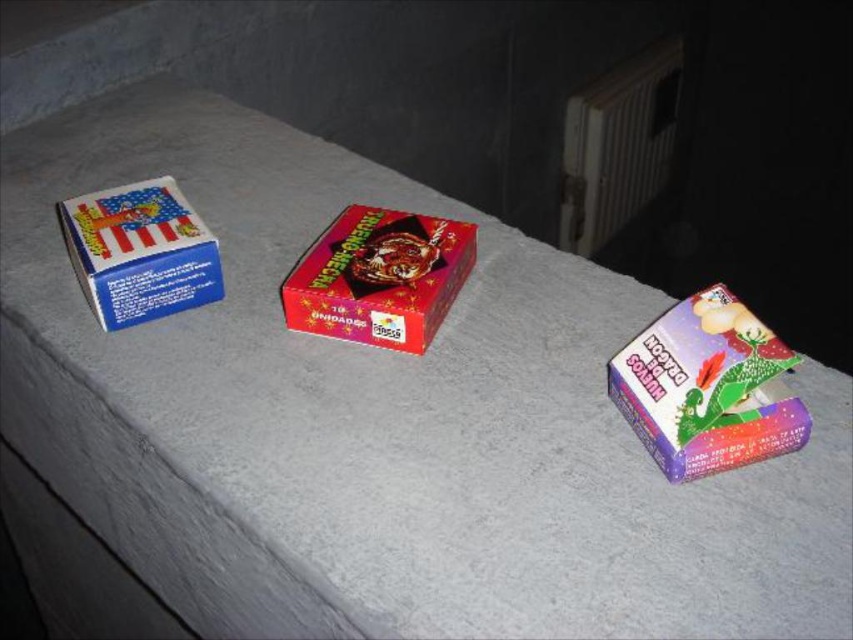
Question: Estimate the real-world distances between objects in this image. Which object is farther from the shiny purple box at right?

Choices:
 (A) metallic gray radiator at upper right
 (B) shiny red box at center

Answer: (A)

Question: Can you confirm if metallic gray radiator at upper right is positioned above blue matte matchbox at left?

Choices:
 (A) yes
 (B) no

Answer: (A)

Question: Is shiny purple box at right further to the viewer compared to blue matte matchbox at left?

Choices:
 (A) yes
 (B) no

Answer: (B)

Question: Is shiny red box at center closer to camera compared to blue matte matchbox at left?

Choices:
 (A) no
 (B) yes

Answer: (B)

Question: Among these objects, which one is farthest from the camera?

Choices:
 (A) blue matte matchbox at left
 (B) metallic gray radiator at upper right

Answer: (B)

Question: Which point is closer to the camera?

Choices:
 (A) (461, 253)
 (B) (115, 188)
 (C) (689, 461)
 (D) (666, 164)

Answer: (C)